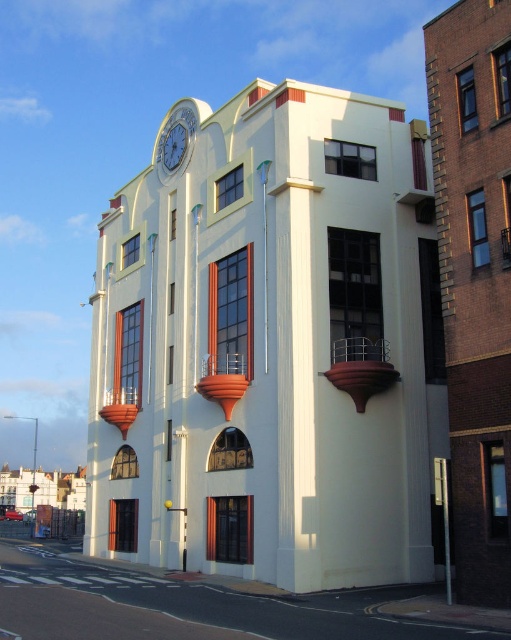
Question: Does white smooth clock tower at center have a greater width compared to white glossy clock at upper center?

Choices:
 (A) yes
 (B) no

Answer: (A)

Question: Based on their relative distances, which object is nearer to the white smooth clock tower at center?

Choices:
 (A) blue glass clock at upper center
 (B) white glossy clock at upper center

Answer: (B)

Question: Does white smooth clock tower at center appear on the left side of white glossy clock at upper center?

Choices:
 (A) yes
 (B) no

Answer: (B)

Question: Which point appears farthest from the camera in this image?

Choices:
 (A) (179, 131)
 (B) (421, 136)

Answer: (A)

Question: Estimate the real-world distances between objects in this image. Which object is farther from the white glossy clock at upper center?

Choices:
 (A) white smooth clock tower at center
 (B) blue glass clock at upper center

Answer: (A)

Question: Does white smooth clock tower at center have a larger size compared to white glossy clock at upper center?

Choices:
 (A) yes
 (B) no

Answer: (A)